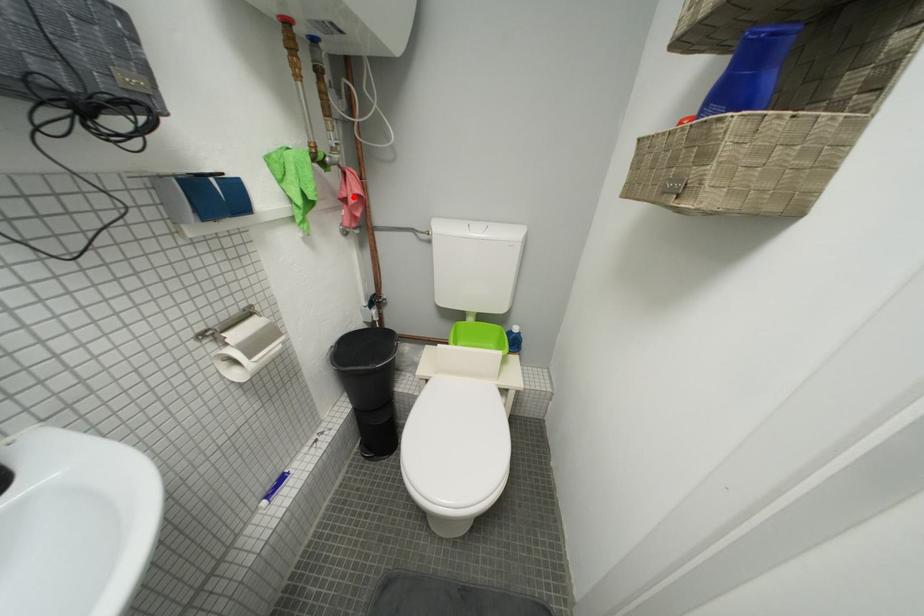
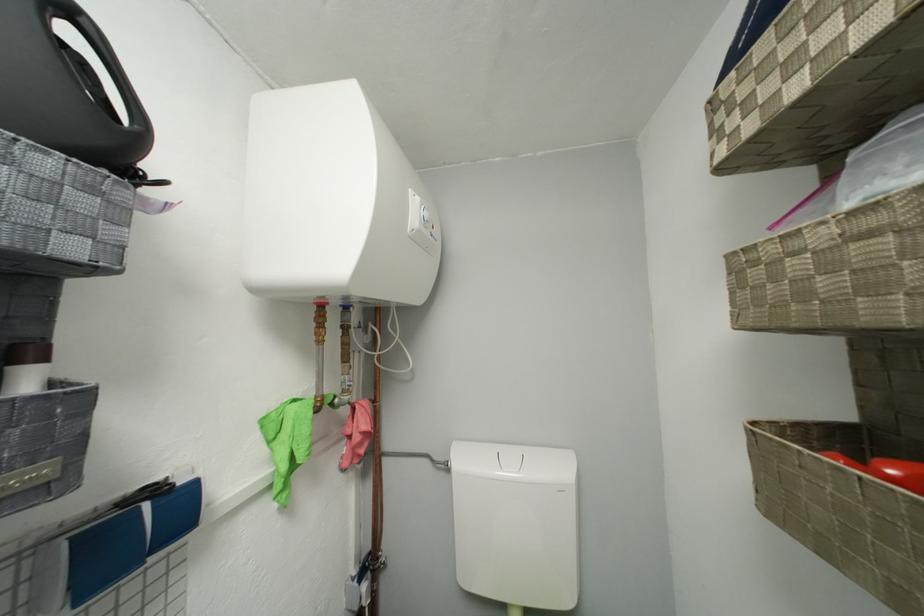
Question: I am providing you with two images of the same scene from different viewpoints. In image1, a red point is highlighted. Considering the same 3D point in image2, which of the following is correct?

Choices:
 (A) It is closer
 (B) It is farther

Answer: (B)